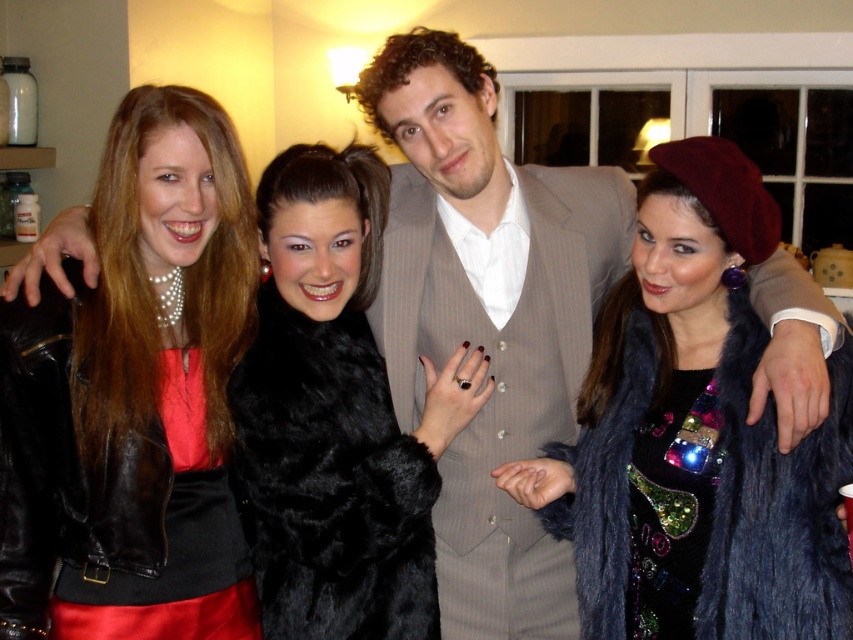
You are standing at the point marked as point (140, 428) and want to greet the group of four people. Considering the distance between you and the group is 4.55 feet, can you comfortably walk towards them without needing to move any obstacles?

The distance between you and the group is 4.55 feet, so yes, you can comfortably walk towards them without needing to move any obstacles as the space is sufficient for movement.

You are a photographer trying to capture a clear shot of both the shiny black leather jacket at left and the fuzzy dark blue fur coat at center. Since you want to ensure both are in focus, which one should you focus on first considering their heights?

The shiny black leather jacket at left is much taller than the fuzzy dark blue fur coat at center, so you should focus on the shiny black leather jacket at left first to ensure both are in focus.

You are taking a photo of two points in the scene. The first point is at coordinate point (x=598, y=531) and the second is at point (x=289, y=356). Which point is closer to your camera?

Point (x=598, y=531) is closer to the camera than point (x=289, y=356).